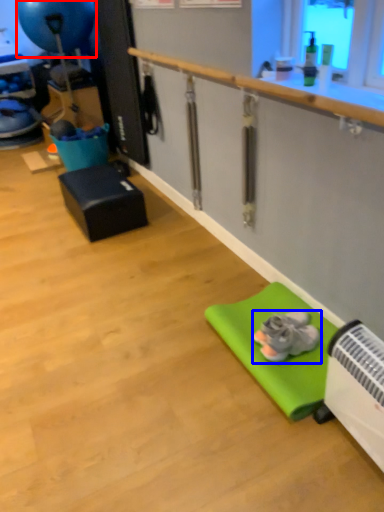
Question: Among these objects, which one is nearest to the camera, balloon (highlighted by a red box) or footwear (highlighted by a blue box)?

Choices:
 (A) balloon
 (B) footwear

Answer: (B)